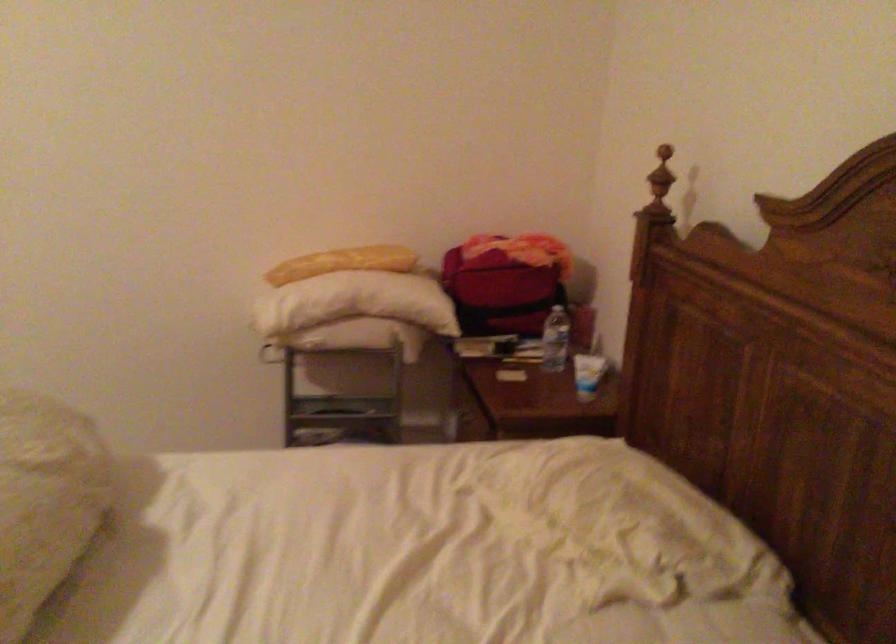
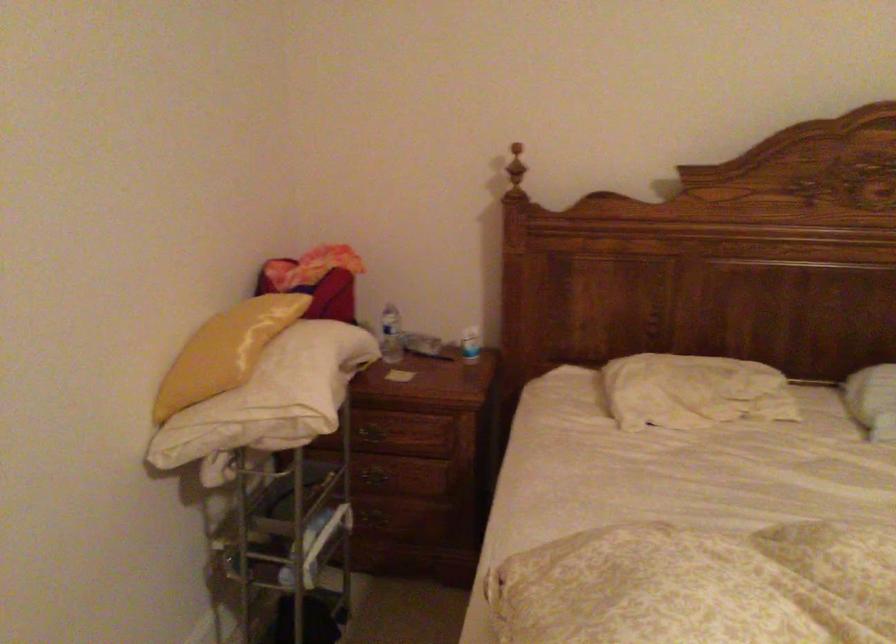
The point at (291, 285) is marked in the first image. Where is the corresponding point in the second image?

(287, 375)